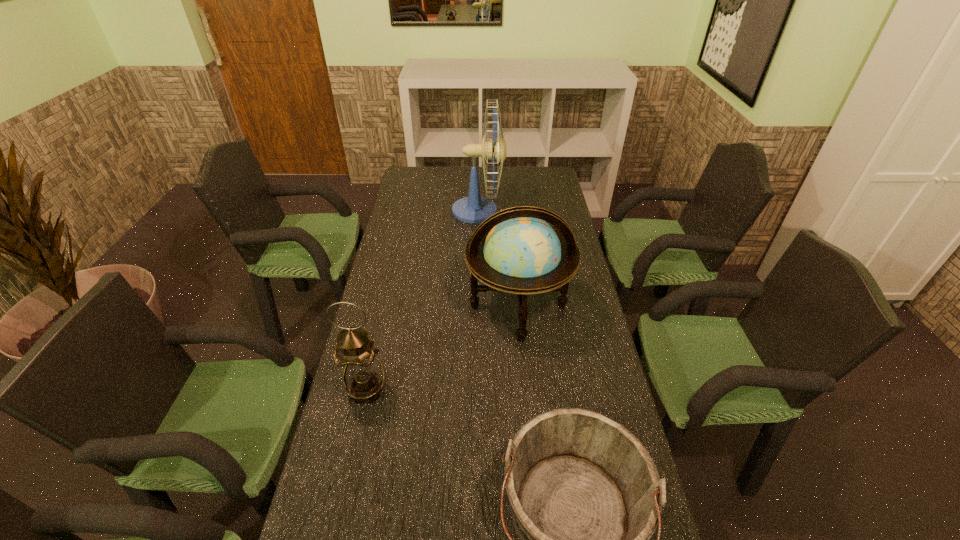
Locate an element on the screen. The width and height of the screenshot is (960, 540). the second closest object to the second farthest object is located at coordinates (363, 375).

Point out which object is positioned as the third nearest to the fan. Please provide its 2D coordinates. Your answer should be formatted as a tuple, i.e. [(x, y)], where the tuple contains the x and y coordinates of a point satisfying the conditions above.

[(585, 496)]

Where is `free spot that satisfies the following two spatial constraints: 1. at the front of the farthest object where the blades are visible; 2. on the front side of the leftmost object`? free spot that satisfies the following two spatial constraints: 1. at the front of the farthest object where the blades are visible; 2. on the front side of the leftmost object is located at coordinates (477, 390).